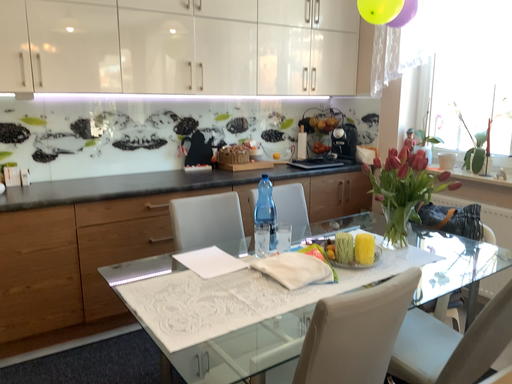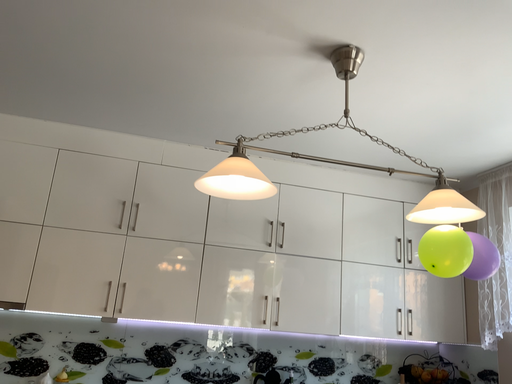
Question: How did the camera likely rotate when shooting the video?

Choices:
 (A) rotated left
 (B) rotated right

Answer: (A)